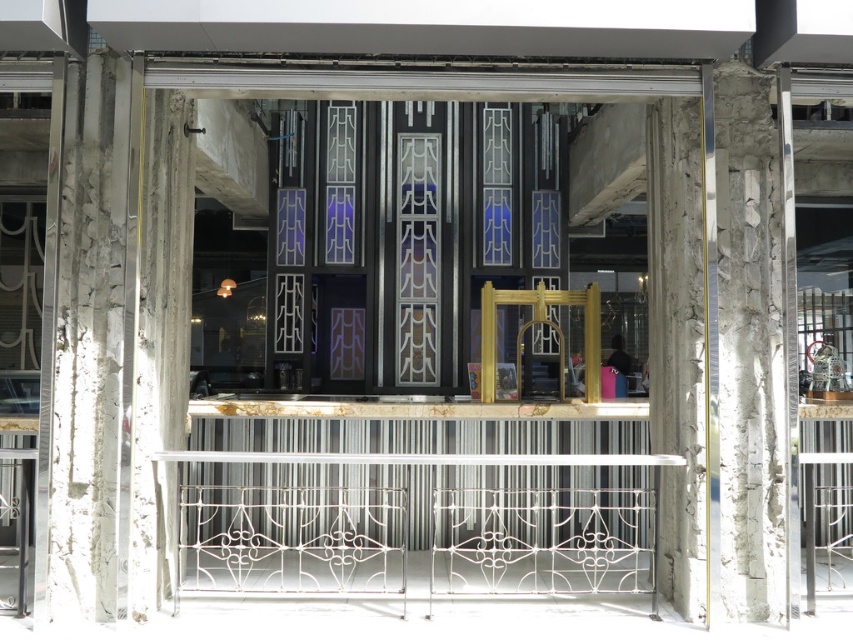
Who is taller, black glass door at center or white wrought iron fence at center?

black glass door at center

The width and height of the screenshot is (853, 640). Identify the location of black glass door at center. (399, 248).